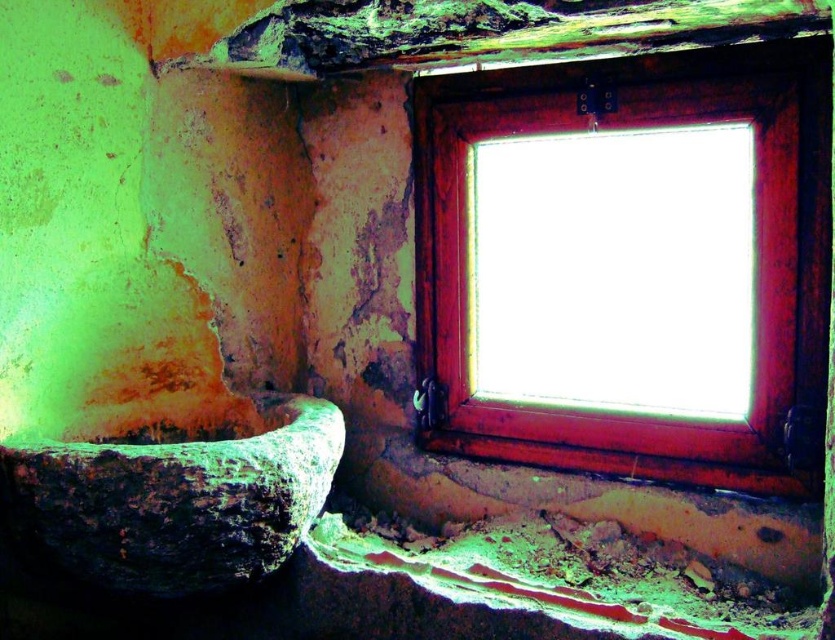
Which is behind, point (449, 442) or point (250, 464)?

The point (449, 442) is behind.

Who is shorter, rusty wood window at upper right or rusty stone bath at lower left?

With less height is rusty stone bath at lower left.

I want to click on rusty wood window at upper right, so click(628, 264).